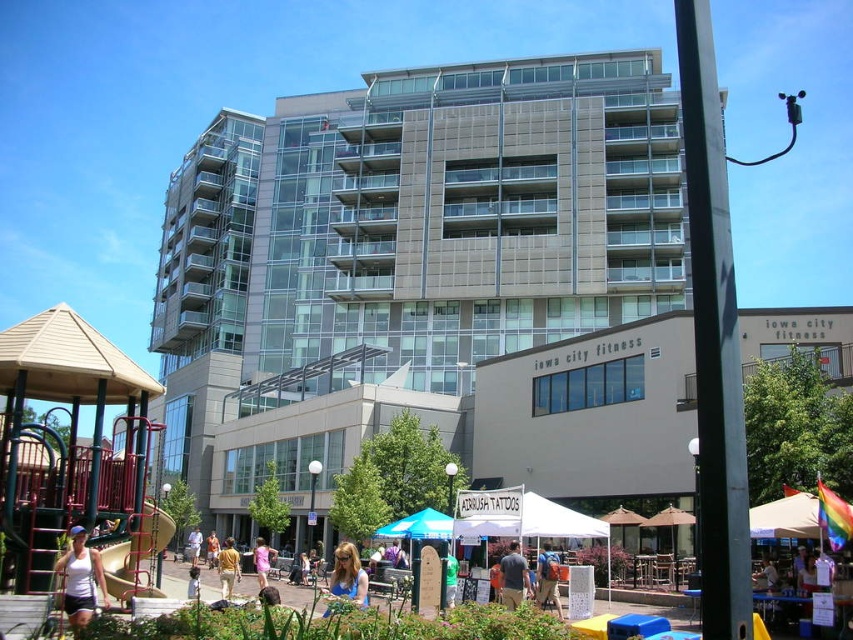
You are at the event and see both the blue denim shirt at center and the light brown wooden skateboard at center. If you are facing the building, which object is closer to your right side?

The blue denim shirt at center is to the right of the light brown wooden skateboard at center, so if you are facing the building, the blue denim shirt at center would be closer to your right side.

You are a photographer at the event and want to capture both the tan cotton shirt at center and the pink fabric dress at center in a single frame. Which clothing item should you focus on first to ensure both are in the frame?

The tan cotton shirt at center is taller than the pink fabric dress at center, so you should focus on the tan cotton shirt at center first to ensure both are in the frame.